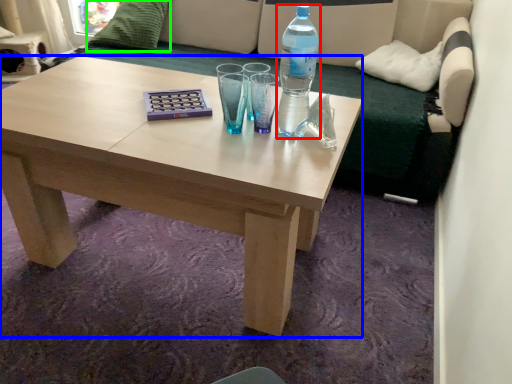
Question: Based on their relative distances, which object is farther from bottle (highlighted by a red box)? Choose from coffee table (highlighted by a blue box) and pillow (highlighted by a green box).

Choices:
 (A) coffee table
 (B) pillow

Answer: (B)